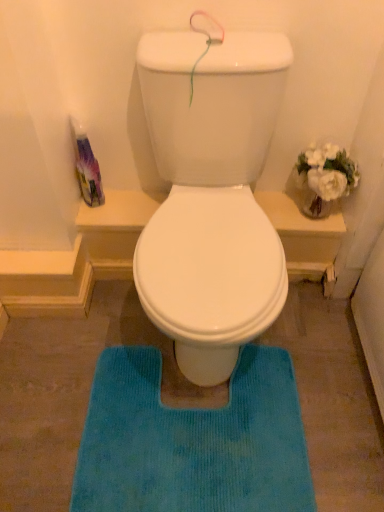
The width and height of the screenshot is (384, 512). In order to click on translucent plastic bottle at left in this screenshot , I will do `click(86, 167)`.

Describe the element at coordinates (86, 167) in the screenshot. I see `translucent plastic bottle at left` at that location.

Measure the distance between translucent plastic bottle at left and camera.

translucent plastic bottle at left and camera are 3.98 feet apart.

This screenshot has height=512, width=384. What are the coordinates of `blue textured bath mat at center` in the screenshot? It's located at (192, 440).

Describe the element at coordinates (192, 440) in the screenshot. I see `blue textured bath mat at center` at that location.

Where is `translucent plastic bottle at left`? This screenshot has height=512, width=384. translucent plastic bottle at left is located at coordinates (86, 167).

Based on the photo, is translucent plastic bottle at left to the left or to the right of blue textured bath mat at center in the image?

Based on their positions, translucent plastic bottle at left is located to the left of blue textured bath mat at center.

From the picture: Which object is closer to the camera, translucent plastic bottle at left or blue textured bath mat at center?

blue textured bath mat at center is closer to the camera.

Does point (90, 147) lie in front of point (249, 499)?

No, (90, 147) is further to viewer.

From the image's perspective, is translucent plastic bottle at left above or below blue textured bath mat at center?

Clearly, from the image's perspective, translucent plastic bottle at left is above blue textured bath mat at center.

From a real-world perspective, is translucent plastic bottle at left above or below blue textured bath mat at center?

translucent plastic bottle at left is above blue textured bath mat at center.

Which object is thinner, translucent plastic bottle at left or blue textured bath mat at center?

translucent plastic bottle at left.

Between translucent plastic bottle at left and blue textured bath mat at center, which one has more height?

Answer: translucent plastic bottle at left is taller.

Can you confirm if translucent plastic bottle at left is smaller than blue textured bath mat at center?

Correct, translucent plastic bottle at left occupies less space than blue textured bath mat at center.

Is translucent plastic bottle at left positioned beyond the bounds of blue textured bath mat at center?

That's correct, translucent plastic bottle at left is outside of blue textured bath mat at center.

Would you consider translucent plastic bottle at left to be distant from blue textured bath mat at center?

translucent plastic bottle at left is actually quite close to blue textured bath mat at center.

Is translucent plastic bottle at left facing away from blue textured bath mat at center?

No, translucent plastic bottle at left's orientation is not away from blue textured bath mat at center.

Can you tell me how much translucent plastic bottle at left and blue textured bath mat at center differ in facing direction?

translucent plastic bottle at left and blue textured bath mat at center are facing 0.785 degrees away from each other.

The image size is (384, 512). Identify the location of bottle above the blue textured bath mat at center (from a real-world perspective). (86, 167).

Based on their positions, is blue textured bath mat at center located to the left or right of translucent plastic bottle at left?

From the image, it's evident that blue textured bath mat at center is to the right of translucent plastic bottle at left.

In the image, is blue textured bath mat at center positioned in front of or behind translucent plastic bottle at left?

In the image, blue textured bath mat at center appears in front of translucent plastic bottle at left.

Which is behind, point (126, 439) or point (80, 149)?

The point (80, 149) is farther from the camera.

From the image's perspective, between blue textured bath mat at center and translucent plastic bottle at left, which one is located above?

translucent plastic bottle at left appears higher in the image.

From a real-world perspective, is blue textured bath mat at center physically located above or below translucent plastic bottle at left?

Clearly, from a real-world perspective, blue textured bath mat at center is below translucent plastic bottle at left.

Based on the photo, between blue textured bath mat at center and translucent plastic bottle at left, which one has smaller width?

translucent plastic bottle at left is thinner.

Based on the photo, from their relative heights in the image, would you say blue textured bath mat at center is taller or shorter than translucent plastic bottle at left?

blue textured bath mat at center is shorter than translucent plastic bottle at left.

Which of these two, blue textured bath mat at center or translucent plastic bottle at left, is smaller?

Smaller between the two is translucent plastic bottle at left.

Which is correct: blue textured bath mat at center is inside translucent plastic bottle at left, or outside of it?

blue textured bath mat at center is located beyond the bounds of translucent plastic bottle at left.

Consider the image. Is blue textured bath mat at center positioned far away from translucent plastic bottle at left?

No.

Based on the photo, could you tell me if blue textured bath mat at center is facing translucent plastic bottle at left?

No, blue textured bath mat at center is not facing towards translucent plastic bottle at left.

What's the angular difference between blue textured bath mat at center and translucent plastic bottle at left's facing directions?

The facing directions of blue textured bath mat at center and translucent plastic bottle at left are 0.785 degrees apart.

How distant is blue textured bath mat at center from translucent plastic bottle at left?

28.61 inches.

This screenshot has height=512, width=384. Identify the location of bath mat that appears in front of the translucent plastic bottle at left. (192, 440).

Identify the location of bath mat on the right of translucent plastic bottle at left. Image resolution: width=384 pixels, height=512 pixels. (192, 440).

At what (x,y) coordinates should I click in order to perform the action: click on bath mat located underneath the translucent plastic bottle at left (from a real-world perspective). Please return your answer as a coordinate pair (x, y). The width and height of the screenshot is (384, 512). Looking at the image, I should click on (192, 440).